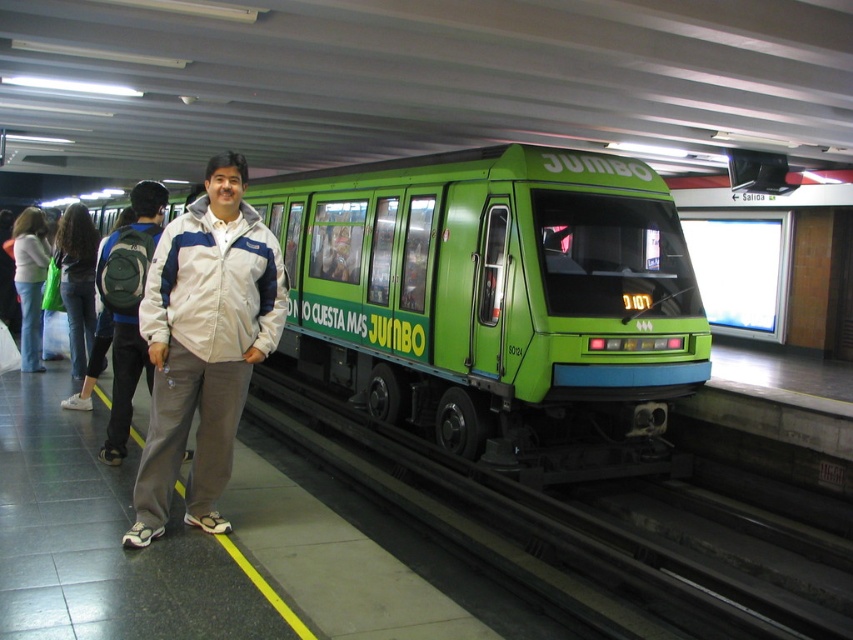
From the picture: Who is higher up, white fabric jacket at center or denim jacket at left?

denim jacket at left is higher up.

Is white fabric jacket at center shorter than denim jacket at left?

Incorrect, white fabric jacket at center's height does not fall short of denim jacket at left's.

Does point (207, 392) lie behind point (24, 305)?

No, it is not.

At what (x,y) coordinates should I click in order to perform the action: click on white fabric jacket at center. Please return your answer as a coordinate pair (x, y). The height and width of the screenshot is (640, 853). Looking at the image, I should click on click(x=204, y=342).

Who is positioned more to the right, green matte train at center or denim jeans at left?

From the viewer's perspective, green matte train at center appears more on the right side.

Based on the photo, is green matte train at center wider than denim jeans at left?

Incorrect, green matte train at center's width does not surpass denim jeans at left's.

Locate an element on the screen. The height and width of the screenshot is (640, 853). green matte train at center is located at coordinates (496, 301).

Between green matte train at center and white fabric jacket at center, which one has less height?

Standing shorter between the two is green matte train at center.

Can you confirm if green matte train at center is positioned above white fabric jacket at center?

No.

Find the location of a particular element. This screenshot has width=853, height=640. green matte train at center is located at coordinates (496, 301).